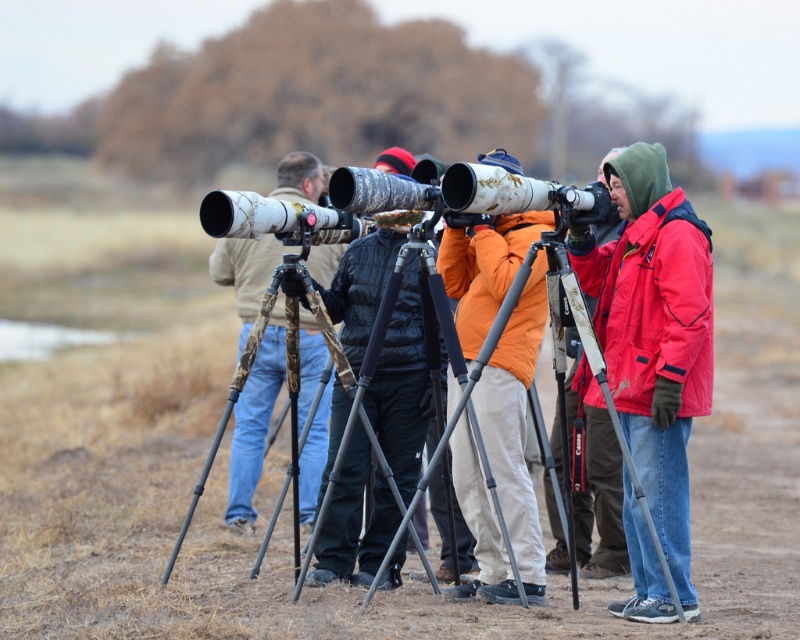
Question: Is camouflage tripod at center below silver metallic tripod at center?

Choices:
 (A) yes
 (B) no

Answer: (B)

Question: Is orange fleece jacket at center bigger than silver metallic tripod at center?

Choices:
 (A) yes
 (B) no

Answer: (B)

Question: Which point is closer to the camera taking this photo?

Choices:
 (A) (552, 300)
 (B) (646, 378)
 (C) (380, 499)

Answer: (B)

Question: Which object appears closest to the camera in this image?

Choices:
 (A) camouflage tripod at center
 (B) camouflage-patterned tripod at center
 (C) orange fleece jacket at center

Answer: (C)

Question: Which object is positioned farthest from the orange fleece jacket at center?

Choices:
 (A) red matte jacket at right
 (B) camouflage tripod at center

Answer: (B)

Question: Is matte black jacket at right thinner than silver metallic tripod at center?

Choices:
 (A) no
 (B) yes

Answer: (B)